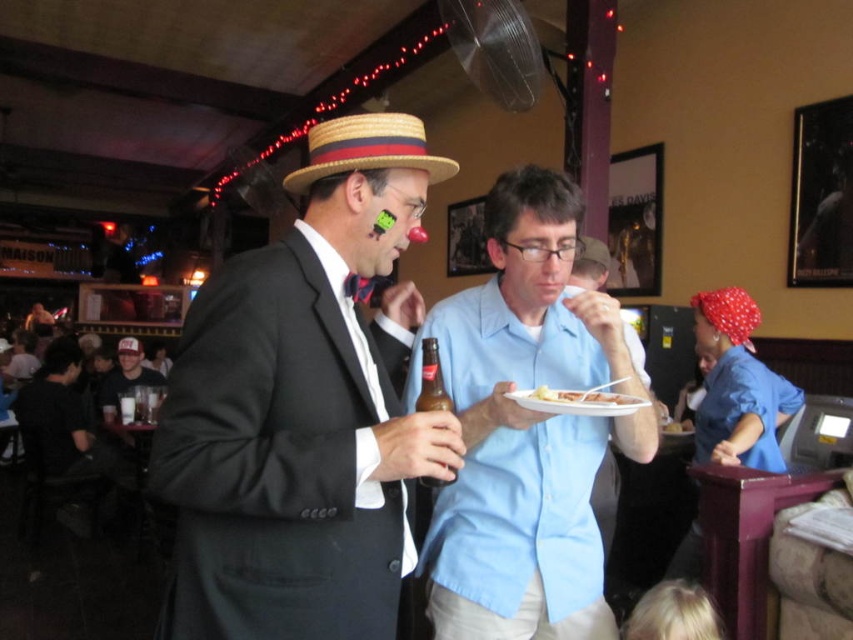
Is straw hat at center thinner than light blue shirt at center?

No.

Is point (297, 192) positioned in front of point (605, 561)?

That is True.

Find the location of `straw hat at center`. straw hat at center is located at coordinates (367, 148).

Between point (437, 304) and point (529, 406), which one is positioned behind?

The point (437, 304) is behind.

Is light blue cotton shirt at center closer to camera compared to white paper plate at center?

That is True.

Is point (546, 198) positioned behind point (625, 400)?

Yes.

Locate an element on the screen. light blue cotton shirt at center is located at coordinates (527, 429).

Which is more to the left, matte black suit at center or white paper plate at center?

matte black suit at center is more to the left.

Between point (368, 234) and point (624, 396), which one is positioned in front?

Point (368, 234)

Is point (252, 588) positioned before point (622, 406)?

Yes, it is.

Identify the location of matte black suit at center. (303, 410).